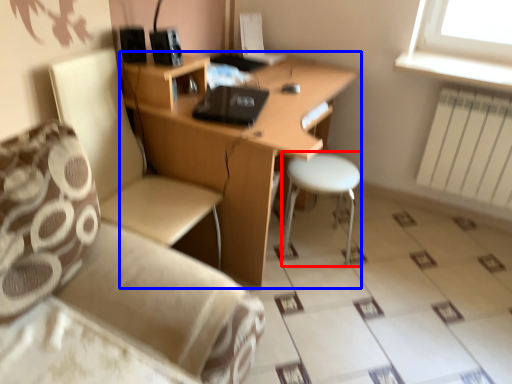
Question: Among these objects, which one is farthest to the camera, bar stool (highlighted by a red box) or desk (highlighted by a blue box)?

Choices:
 (A) bar stool
 (B) desk

Answer: (A)